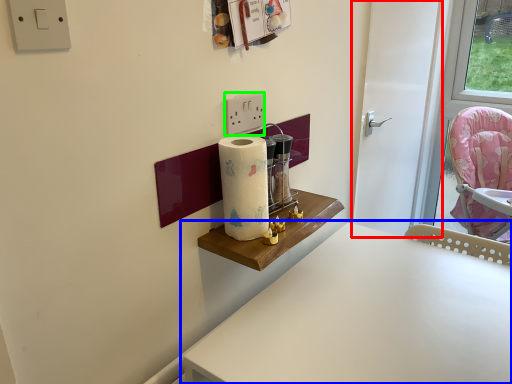
Question: Which object is the closest to the door (highlighted by a red box)? Choose among these: table (highlighted by a blue box) or light switch (highlighted by a green box).

Choices:
 (A) table
 (B) light switch

Answer: (A)